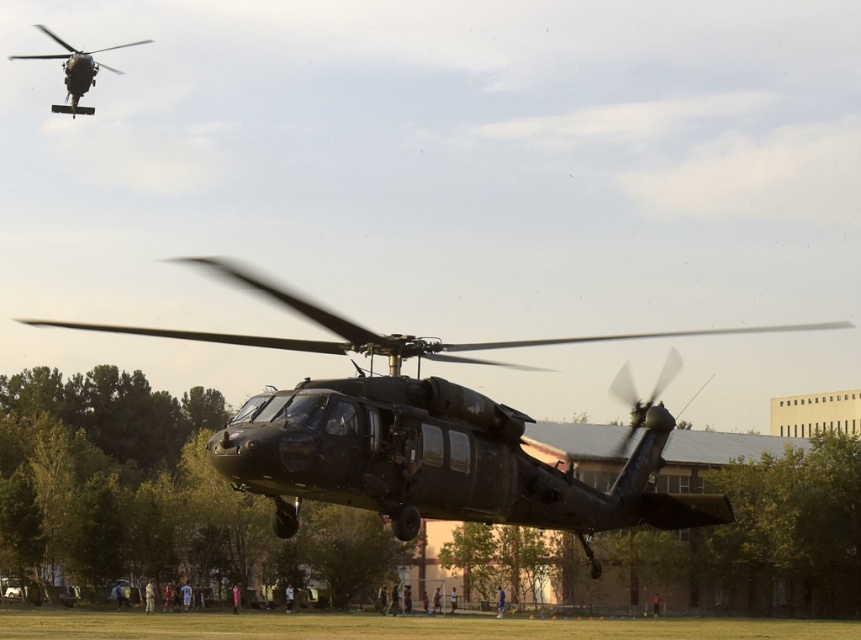
You are a drone operator who needs to fly a drone between the two matte black helicopters. The drone has a maximum flight distance of 25 meters. Can you safely fly the drone between the matte black helicopter at center and the matte black helicopter at upper left without exceeding its range?

The distance between the matte black helicopter at center and the matte black helicopter at upper left is 25.23 meters. Since the drone can only fly up to 25 meters, it cannot safely fly between them without exceeding its maximum range.

You are a drone operator trying to navigate between two points in the image. The first point is at coordinates point (629, 464) and the second is at point (59, 40). Which point is closer to you?

Point (629, 464) is closer to the viewer than point (59, 40).